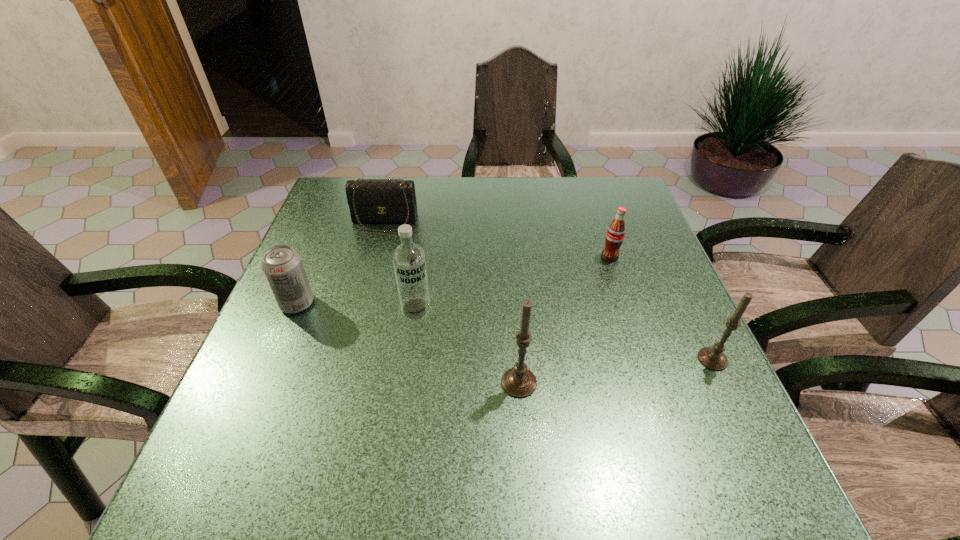
You are a GUI agent. You are given a task and a screenshot of the screen. Output one action in this format:
    pyautogui.click(x=<x>, y=<y>)
    Task: Click on the left candle
    The width and height of the screenshot is (960, 540).
    Given the screenshot: What is the action you would take?
    pyautogui.click(x=519, y=382)

Where is `the taller candle`? This screenshot has width=960, height=540. the taller candle is located at coordinates (519, 382).

Locate an element on the screen. The height and width of the screenshot is (540, 960). the fourth shortest object is located at coordinates coord(713,358).

Identify the location of the rightmost object. The height and width of the screenshot is (540, 960). (713, 358).

At what (x,y) coordinates should I click in order to perform the action: click on clutch bag. Please return your answer as a coordinate pair (x, y). This screenshot has width=960, height=540. Looking at the image, I should click on (370, 200).

Locate an element on the screen. the shortest object is located at coordinates (370, 200).

I want to click on the second farthest object, so click(615, 234).

Identify the location of the farther soda can. (615, 234).

Identify the location of the fourth object from right to left. (409, 260).

Where is `the left soda can`? The height and width of the screenshot is (540, 960). the left soda can is located at coordinates (282, 266).